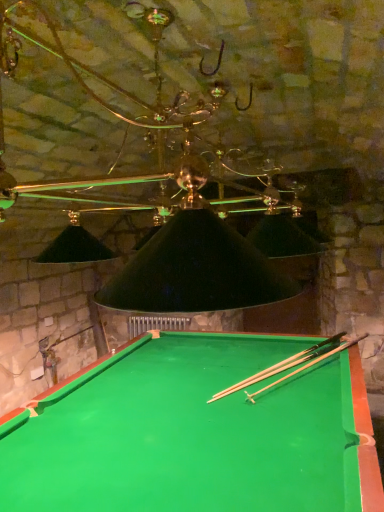
What are the coordinates of `wooden cue at center` in the screenshot? It's located at (281, 366).

This screenshot has width=384, height=512. Describe the element at coordinates (281, 366) in the screenshot. I see `wooden cue at center` at that location.

This screenshot has width=384, height=512. What do you see at coordinates (195, 434) in the screenshot? I see `green felt billiard table at center` at bounding box center [195, 434].

This screenshot has width=384, height=512. I want to click on green felt billiard table at center, so click(195, 434).

Locate an element on the screen. The height and width of the screenshot is (512, 384). wooden cue at center is located at coordinates [281, 366].

Is wooden cue at center at the left side of green felt billiard table at center?

Incorrect, wooden cue at center is not on the left side of green felt billiard table at center.

Is wooden cue at center further to the viewer compared to green felt billiard table at center?

That is True.

Does point (317, 351) come behind point (353, 389)?

Yes, it is.

From the image's perspective, would you say wooden cue at center is positioned over green felt billiard table at center?

Correct, wooden cue at center appears higher than green felt billiard table at center in the image.

From a real-world perspective, who is located lower, wooden cue at center or green felt billiard table at center?

green felt billiard table at center.

Does wooden cue at center have a lesser width compared to green felt billiard table at center?

Indeed, wooden cue at center has a lesser width compared to green felt billiard table at center.

Who is shorter, wooden cue at center or green felt billiard table at center?

Standing shorter between the two is wooden cue at center.

Can you confirm if wooden cue at center is smaller than green felt billiard table at center?

Yes, wooden cue at center is smaller than green felt billiard table at center.

Choose the correct answer: Is wooden cue at center inside green felt billiard table at center or outside it?

The correct answer is: inside.

Is wooden cue at center positioned far away from green felt billiard table at center?

That's not correct — wooden cue at center is a little close to green felt billiard table at center.

Could you tell me if wooden cue at center is facing green felt billiard table at center?

Yes, wooden cue at center is aimed at green felt billiard table at center.

Can you tell me how much wooden cue at center and green felt billiard table at center differ in facing direction?

60.3 degrees separate the facing orientations of wooden cue at center and green felt billiard table at center.

Measure the distance between wooden cue at center and green felt billiard table at center.

wooden cue at center and green felt billiard table at center are 19.63 inches apart.

Locate an element on the screen. This screenshot has width=384, height=512. cue located behind the green felt billiard table at center is located at coordinates (281, 366).

Does green felt billiard table at center appear on the left side of wooden cue at center?

Correct, you'll find green felt billiard table at center to the left of wooden cue at center.

Between green felt billiard table at center and wooden cue at center, which one is positioned behind?

wooden cue at center is further from the camera.

Is point (180, 353) closer to camera compared to point (312, 347)?

No, it is not.

From the image's perspective, between green felt billiard table at center and wooden cue at center, which one is located above?

wooden cue at center is shown above in the image.

From a real-world perspective, is green felt billiard table at center over wooden cue at center?

No, from a real-world perspective, green felt billiard table at center is not over wooden cue at center

Does green felt billiard table at center have a lesser width compared to wooden cue at center?

In fact, green felt billiard table at center might be wider than wooden cue at center.

Between green felt billiard table at center and wooden cue at center, which one has less height?

wooden cue at center is shorter.

Considering the sizes of objects green felt billiard table at center and wooden cue at center in the image provided, who is smaller, green felt billiard table at center or wooden cue at center?

Smaller between the two is wooden cue at center.

Would you say green felt billiard table at center is outside wooden cue at center?

green felt billiard table at center is positioned outside wooden cue at center.

Is green felt billiard table at center next to wooden cue at center?

green felt billiard table at center and wooden cue at center are not in contact.

Is green felt billiard table at center oriented away from wooden cue at center?

green felt billiard table at center is not turned away from wooden cue at center.

This screenshot has height=512, width=384. I want to click on cue above the green felt billiard table at center (from the image's perspective), so click(x=281, y=366).

Where is `cue that is above the green felt billiard table at center (from a real-world perspective)`? The image size is (384, 512). cue that is above the green felt billiard table at center (from a real-world perspective) is located at coordinates (281, 366).

Where is `cue above the green felt billiard table at center (from the image's perspective)`? cue above the green felt billiard table at center (from the image's perspective) is located at coordinates (281, 366).